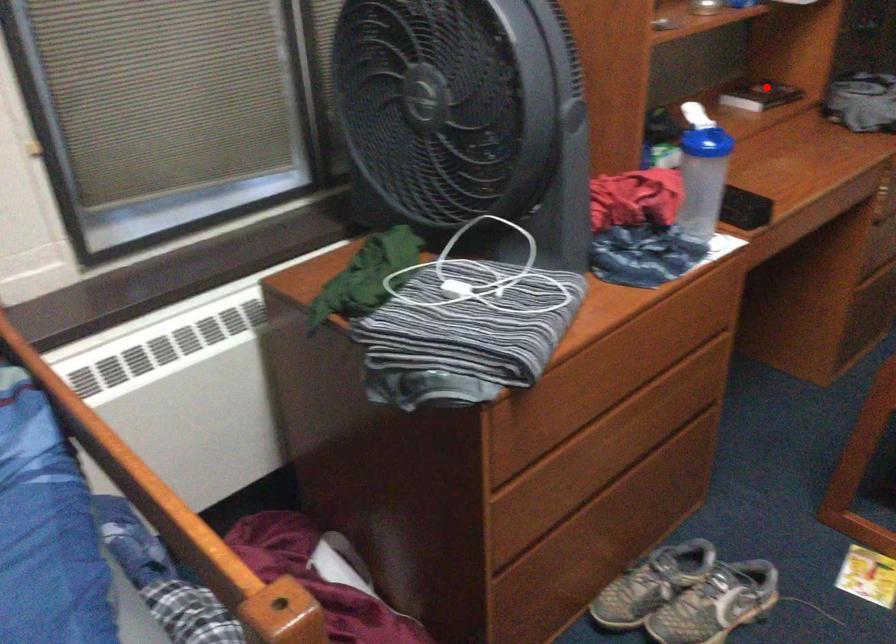
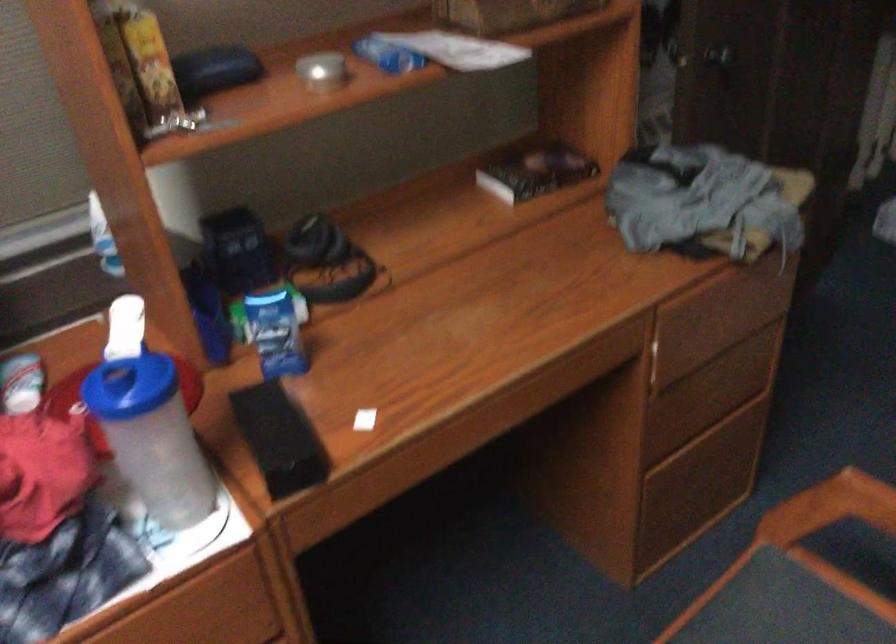
In the second image, find the point that corresponds to the highlighted location in the first image.

(536, 172)